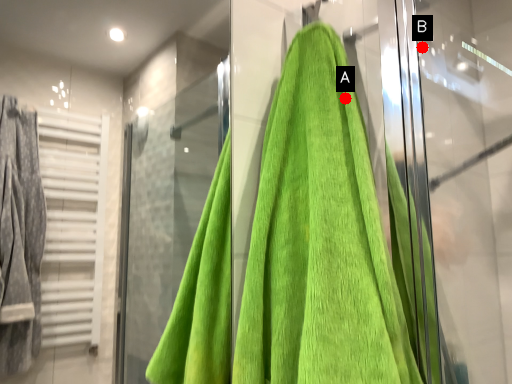
Question: Two points are circled on the image, labeled by A and B beside each circle. Which point is closer to the camera taking this photo?

Choices:
 (A) A is closer
 (B) B is closer

Answer: (A)